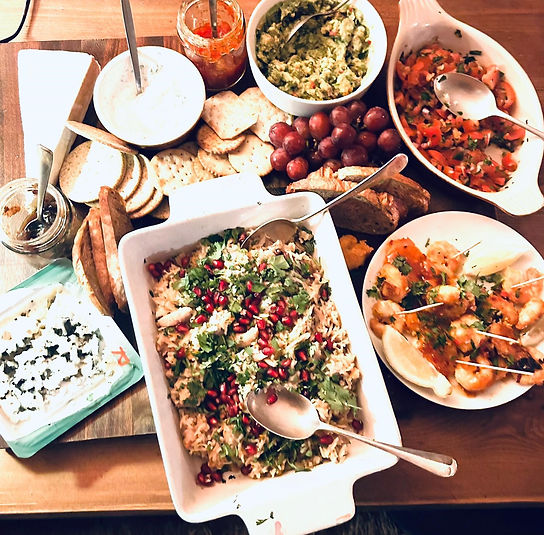
Where is `table`? table is located at coordinates (474, 480), (122, 473).